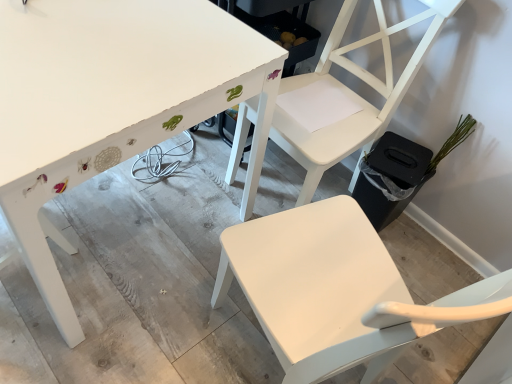
Question: From a real-world perspective, is white matte chair at upper right, which is the first chair in top-to-bottom order, above or below white painted wood table at upper left?

Choices:
 (A) below
 (B) above

Answer: (B)

Question: Is point (349, 147) positioned closer to the camera than point (112, 104)?

Choices:
 (A) closer
 (B) farther

Answer: (B)

Question: Estimate the real-world distances between objects in this image. Which object is closer to the white painted wood table at upper left?

Choices:
 (A) green matte plant at right
 (B) white matte chair at upper center, the 1th chair positioned from the bottom
 (C) white matte chair at upper right, the 2th chair when ordered from bottom to top

Answer: (C)

Question: Which is farther from the white matte chair at upper center, the 1th chair positioned from the bottom?

Choices:
 (A) green matte plant at right
 (B) white painted wood table at upper left
 (C) white matte chair at upper right, which is the first chair in top-to-bottom order

Answer: (A)